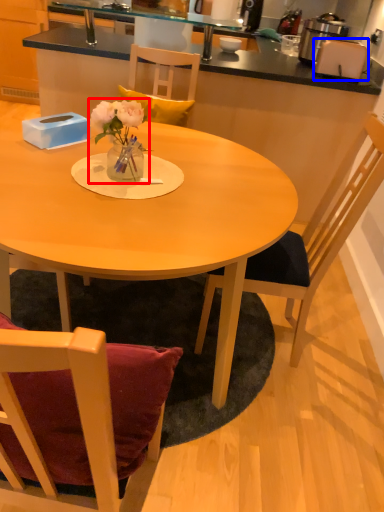
Question: Which object is closer to the camera taking this photo, floral arrangement (highlighted by a red box) or toaster (highlighted by a blue box)?

Choices:
 (A) floral arrangement
 (B) toaster

Answer: (A)